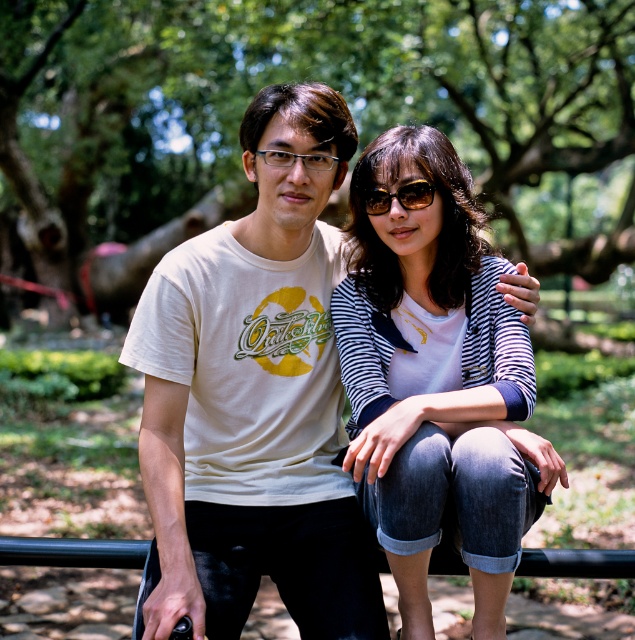
Question: Does sunglasses at center appear over clear plastic glasses at center?

Choices:
 (A) no
 (B) yes

Answer: (A)

Question: Which object is positioned farthest from the clear plastic glasses at center?

Choices:
 (A) green leafy tree at center
 (B) white cotton t-shirt at center
 (C) denim jeans at center
 (D) sunglasses at center

Answer: (A)

Question: Considering the real-world distances, which object is closest to the denim jeans at center?

Choices:
 (A) sunglasses at center
 (B) white cotton t-shirt at center
 (C) clear plastic glasses at center

Answer: (B)

Question: Estimate the real-world distances between objects in this image. Which object is closer to the white cotton t-shirt at center?

Choices:
 (A) denim jeans at center
 (B) clear plastic glasses at center
 (C) green leafy tree at center
 (D) sunglasses at center

Answer: (A)

Question: Can you confirm if white cotton t-shirt at center is thinner than clear plastic glasses at center?

Choices:
 (A) no
 (B) yes

Answer: (A)

Question: Is white cotton t-shirt at center bigger than sunglasses at center?

Choices:
 (A) no
 (B) yes

Answer: (B)